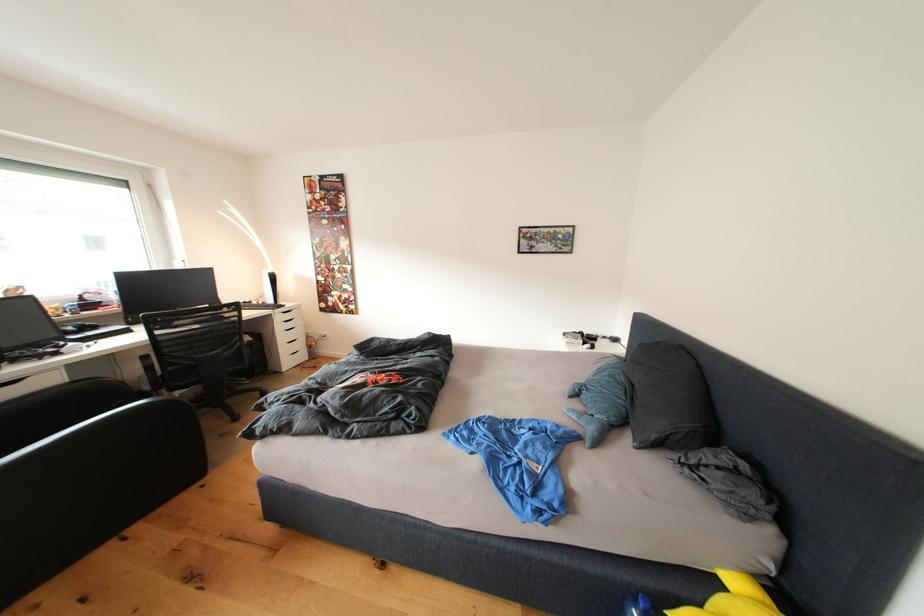
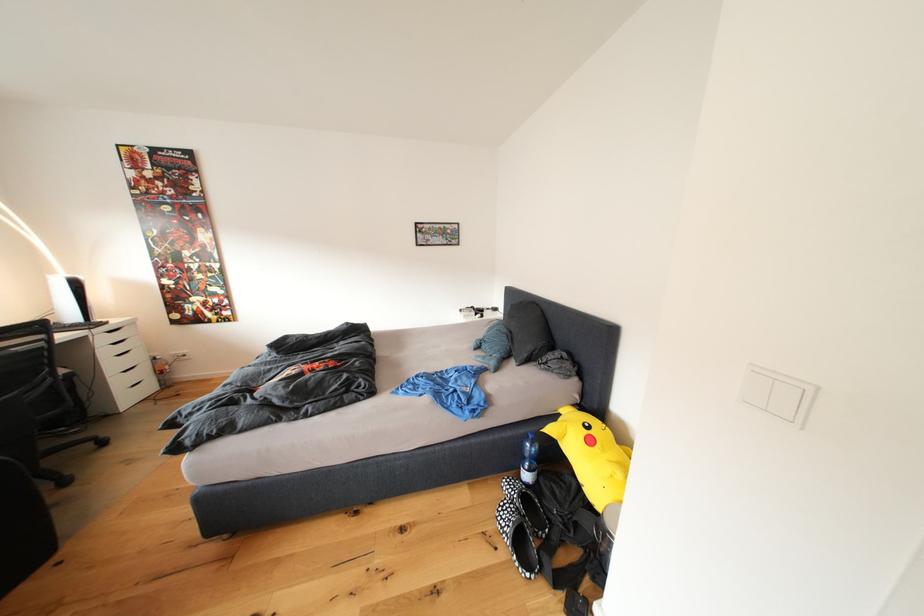
Locate, in the second image, the point that corresponds to (x=310, y=351) in the first image.

(152, 379)